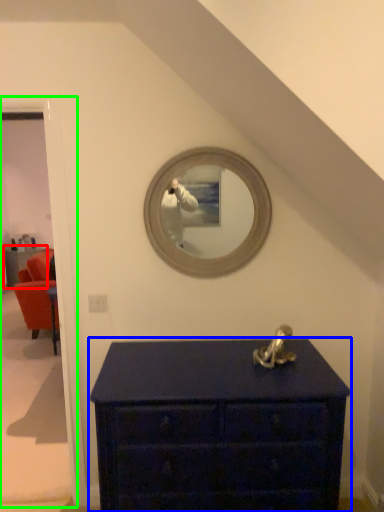
Question: Based on their relative distances, which object is farther from furniture (highlighted by a red box)? Choose from chest of drawers (highlighted by a blue box) and door (highlighted by a green box).

Choices:
 (A) chest of drawers
 (B) door

Answer: (A)